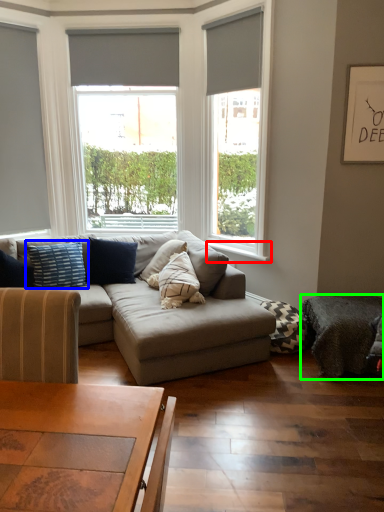
Question: Which is farther away from window sill (highlighted by a red box)? pillow (highlighted by a blue box) or footrest (highlighted by a green box)?

Choices:
 (A) pillow
 (B) footrest

Answer: (A)